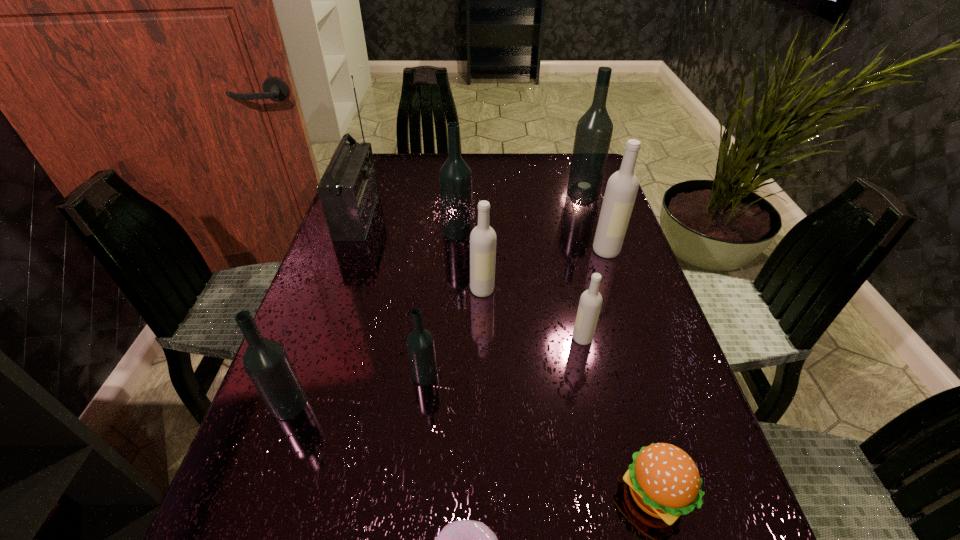
In the image, there is a desktop. At what (x,y) coordinates should I click in order to perform the action: click on vacant space at the far edge. Please return your answer as a coordinate pair (x, y). This screenshot has height=540, width=960. Looking at the image, I should click on (516, 154).

Locate an element on the screen. The height and width of the screenshot is (540, 960). vacant space at the left edge is located at coordinates (358, 269).

Locate an element on the screen. The width and height of the screenshot is (960, 540). blank area at the right edge is located at coordinates (620, 253).

The image size is (960, 540). Find the location of `free space at the far left corner`. free space at the far left corner is located at coordinates (394, 186).

The image size is (960, 540). Find the location of `empty space between the third farthest vodka and the rightmost black vodka`. empty space between the third farthest vodka and the rightmost black vodka is located at coordinates (594, 222).

You are a GUI agent. You are given a task and a screenshot of the screen. Output one action in this format:
    pyautogui.click(x=<x>, y=<y>)
    Task: Click on the empty location between the farthest white vodka and the biggest black vodka
    
    Given the screenshot: What is the action you would take?
    pyautogui.click(x=594, y=222)

Locate an element on the screen. The height and width of the screenshot is (540, 960). vacant space that is in between the third nearest black vodka and the second shortest object is located at coordinates (556, 362).

Where is `free space between the gray radio receiver and the hamburger`? This screenshot has height=540, width=960. free space between the gray radio receiver and the hamburger is located at coordinates (506, 355).

Find the location of a particular element. This screenshot has height=540, width=960. vacant space in between the third smallest black vodka and the hamburger is located at coordinates 556,362.

In order to click on the fifth closest object to the third farthest black vodka in this screenshot , I will do (664, 481).